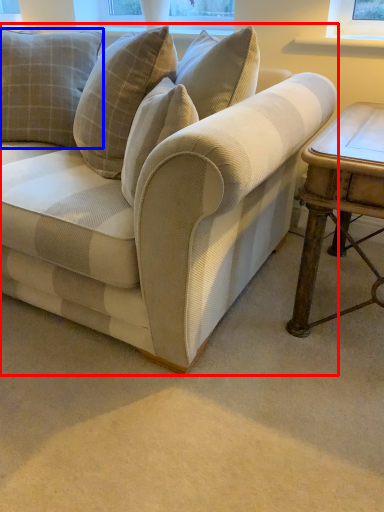
Question: Among these objects, which one is nearest to the camera, studio couch (highlighted by a red box) or pillow (highlighted by a blue box)?

Choices:
 (A) studio couch
 (B) pillow

Answer: (A)